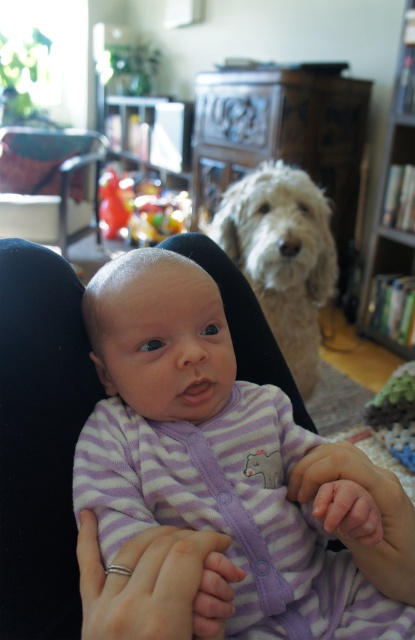
You are a photographer setting up a shoot in this room. You need to position a large equipment box that is 1.2 meters tall. The wooden bookshelf at right is 1.5 meters tall. Can the white fluffy dog at upper center fit under the box if placed next to the bookshelf?

The white fluffy dog at upper center is smaller than the wooden bookshelf at right, which is 1.5 meters tall. Since the equipment box is 1.2 meters tall, the dog can fit under it as it is shorter than the box.

Where is the white fluffy dog at upper center located in the image?

The white fluffy dog at upper center is located at point 0.402 in the x axis and 0.682 in the y axis.

You are a photographer setting up for a family photo. You want to ensure both the purple striped onesie at center and the white fluffy dog at upper center are in focus. The camera you are using has a depth of field that can cover 35 inches. Will both subjects be in focus?

The distance between the purple striped onesie at center and the white fluffy dog at upper center is 35.50 inches. Since the camera can only cover 35 inches, they will not both be in focus.